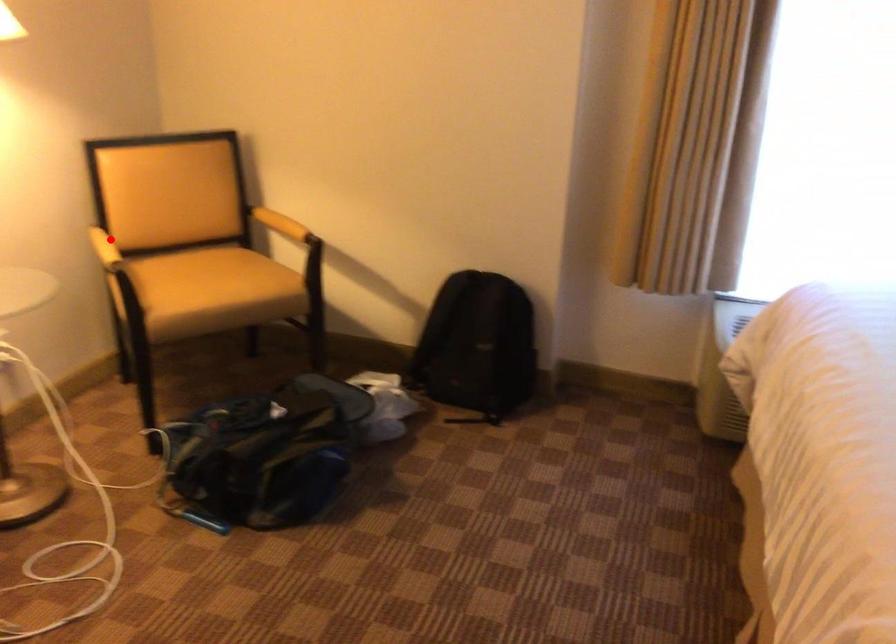
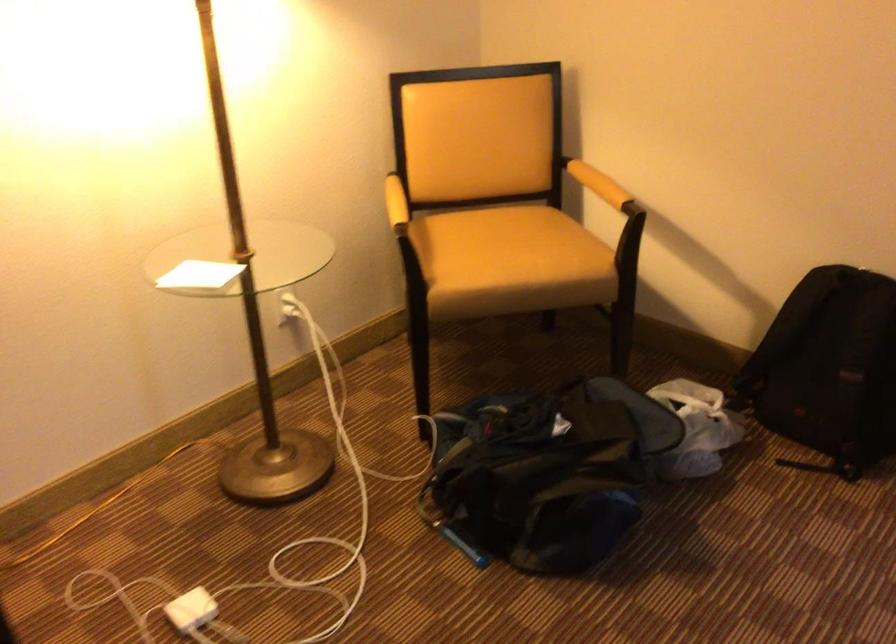
Find the pixel in the second image that matches the highlighted location in the first image.

(395, 203)